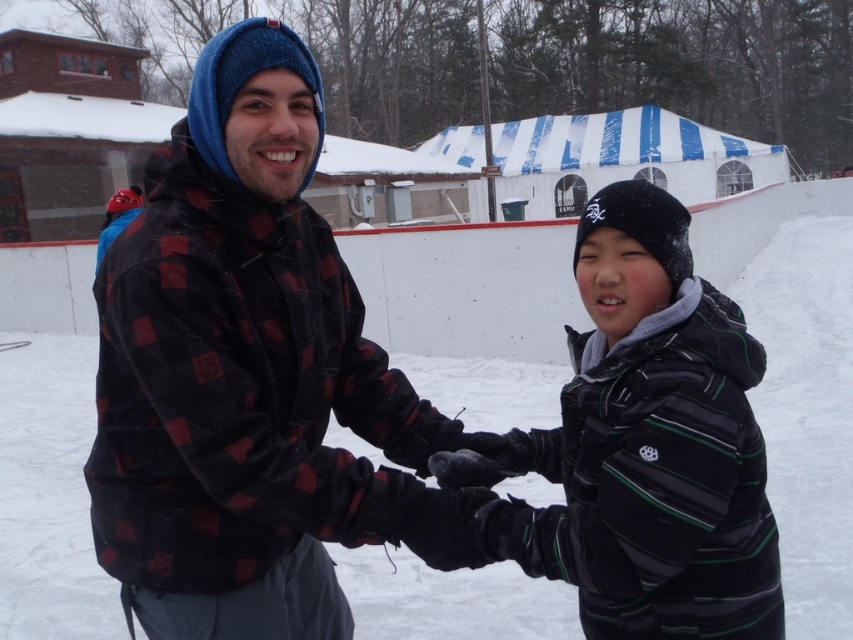
You are standing at the edge of the ice rink and see two points marked on the ice. The first point is at coordinates point (439, 596) and the second point is at point (601, 317). Which point is closer to you?

Point (439, 596) is closer to you because it is further to the viewer than point (601, 317).

You are a photographer standing at the edge of the ice rink. You want to take a group photo of the two people wearing the plaid fabric jacket at center and the striped fleece jacket at center. The minimum distance required for your camera to focus properly is 20 inches. Will the camera be able to focus on both individuals clearly?

The plaid fabric jacket at center and striped fleece jacket at center are 21.06 inches apart from each other, which exceeds the camera minimum focusing distance of 20 inches. Therefore, the camera can focus on both individuals clearly.